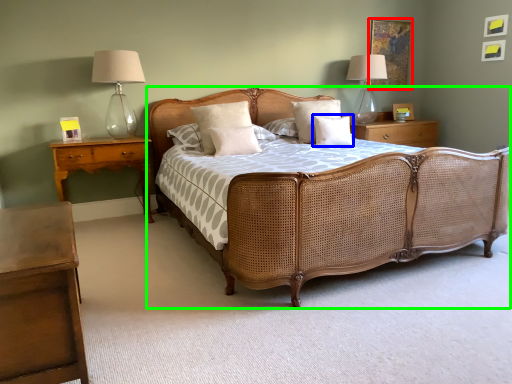
Question: Estimate the real-world distances between objects in this image. Which object is closer to picture frame (highlighted by a red box), pillow (highlighted by a blue box) or bed (highlighted by a green box)?

Choices:
 (A) pillow
 (B) bed

Answer: (A)